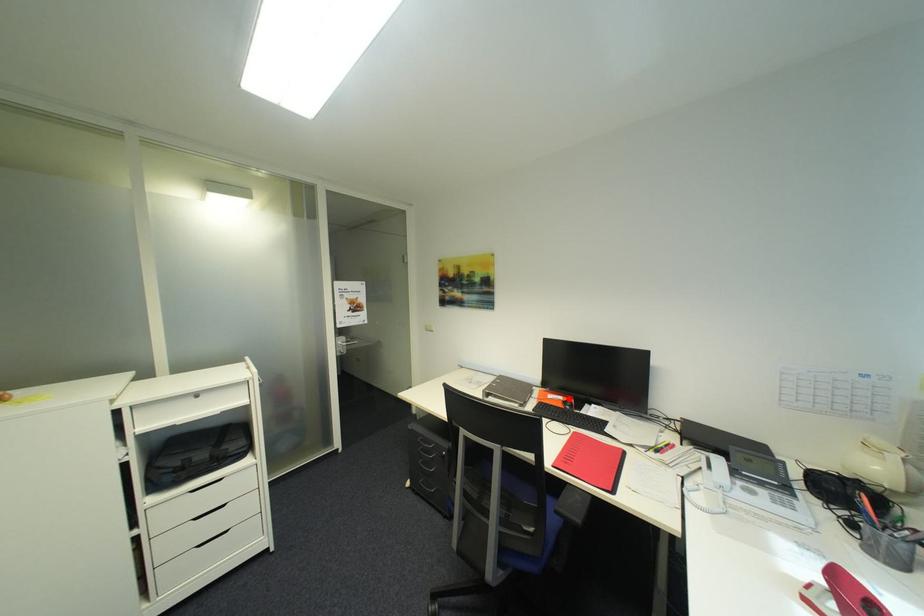
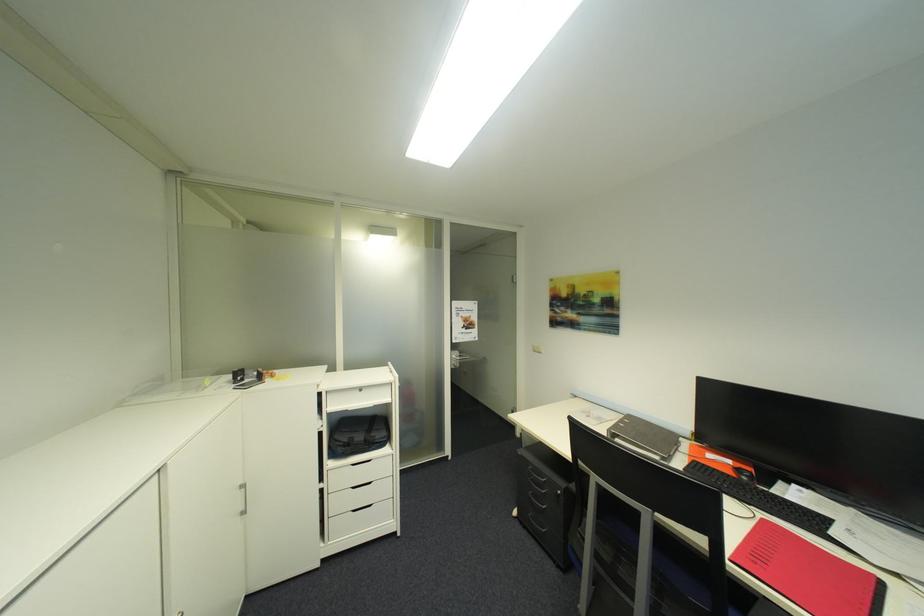
In the second image, find the point that corresponds to the highlighted location in the first image.

(736, 463)